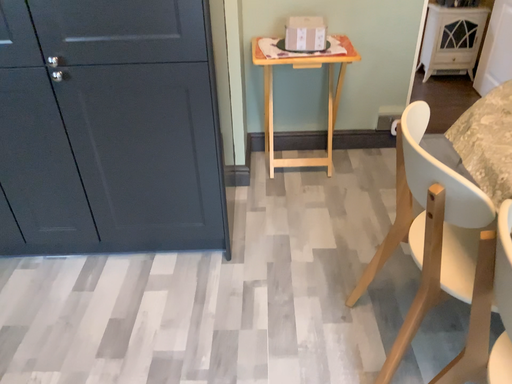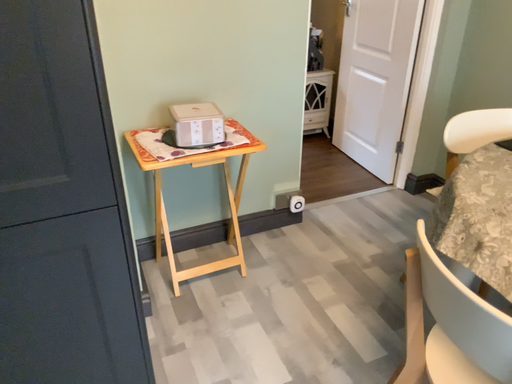
Question: How did the camera likely rotate when shooting the video?

Choices:
 (A) rotated upward
 (B) rotated downward

Answer: (A)